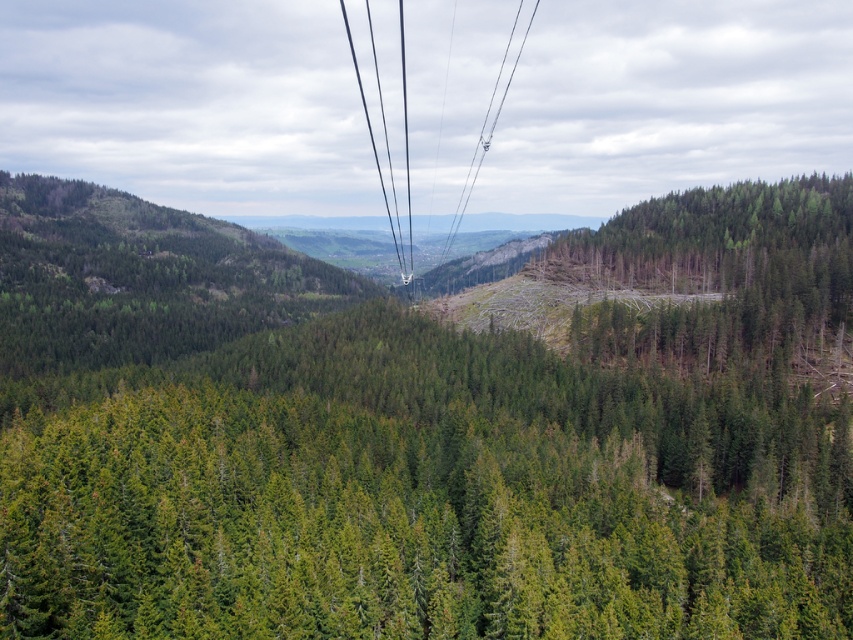
Looking at this image, you are in a cable car moving through the forest. You notice the green matte forest at center and the metallic wire at center. Which one appears closer to you from your aerial viewpoint?

The green matte forest at center appears closer because it is in front of the metallic wire at center from your aerial viewpoint.

You are navigating a drone through a forest landscape. Your mission is to drop a package at the exact center of the green matte forest at center. The coordinate system starts at the bottom left corner of the image. What are the coordinates where you should drop the package?

The coordinates for dropping the package at the exact center of the green matte forest at center are point (393, 451).